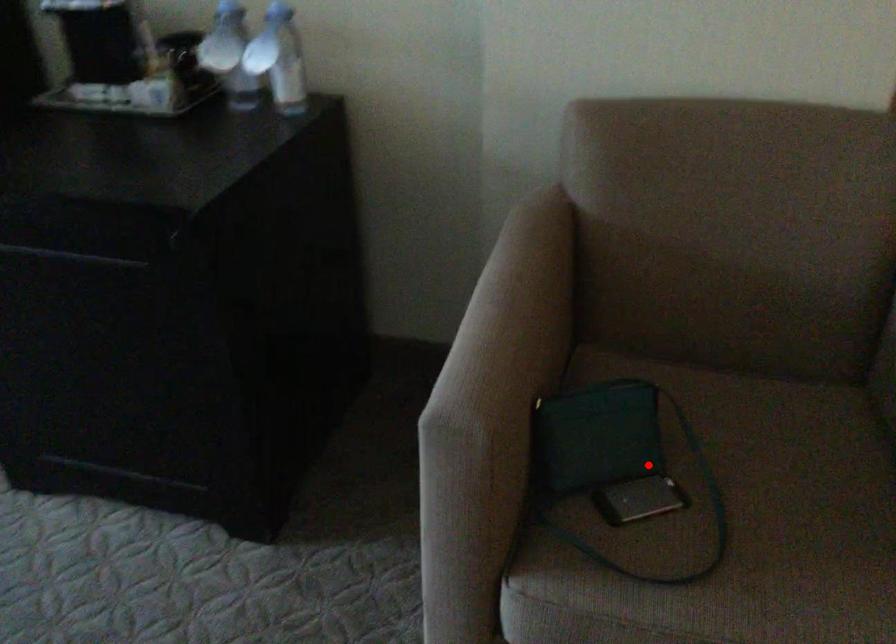
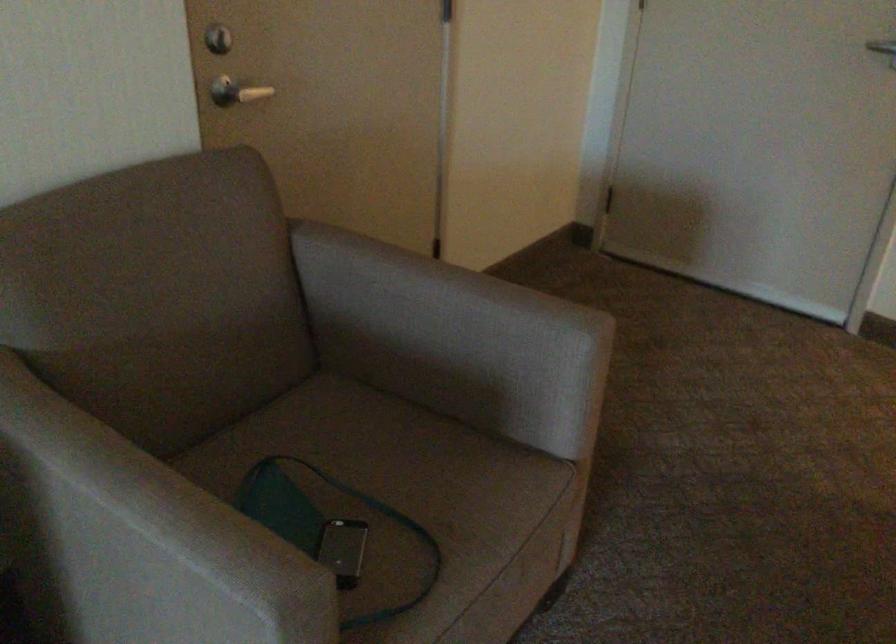
Locate, in the second image, the point that corresponds to the highlighted location in the first image.

(322, 526)